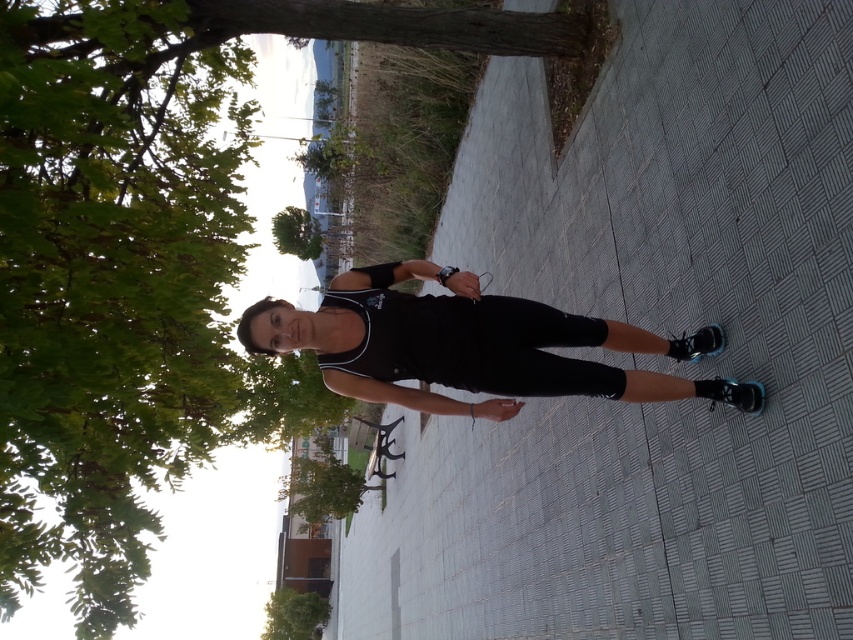
Who is taller, green leafy tree at upper left or green leafy tree at lower left?

green leafy tree at upper left

Does point (175, 465) lie behind point (309, 616)?

No, (175, 465) is closer to viewer.

I want to click on green leafy tree at upper left, so click(144, 259).

Consider the image. Who is shorter, green leafy tree at upper left or black matte tank top at center?

black matte tank top at center is shorter.

Does green leafy tree at upper left appear on the left side of black matte tank top at center?

Indeed, green leafy tree at upper left is positioned on the left side of black matte tank top at center.

Does point (165, 198) come closer to viewer compared to point (279, 344)?

No, it is not.

Identify the location of green leafy tree at upper left. The height and width of the screenshot is (640, 853). (144, 259).

Looking at this image, does black matte tank top at center have a larger size compared to green leafy tree at lower left?

Actually, black matte tank top at center might be smaller than green leafy tree at lower left.

Image resolution: width=853 pixels, height=640 pixels. Describe the element at coordinates (471, 346) in the screenshot. I see `black matte tank top at center` at that location.

Image resolution: width=853 pixels, height=640 pixels. Identify the location of black matte tank top at center. (471, 346).